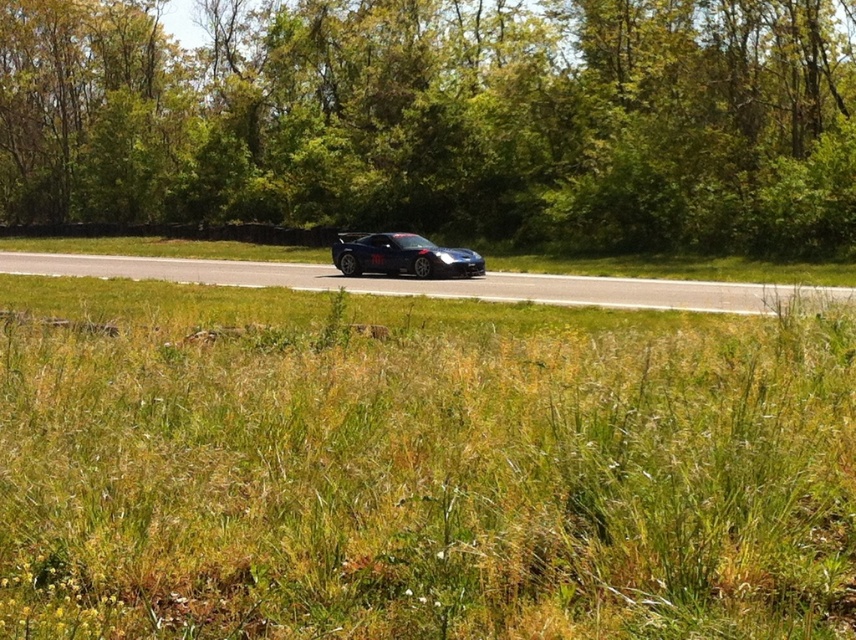
Question: Which of the following is the closest to the observer?

Choices:
 (A) (418, 248)
 (B) (502, 433)

Answer: (B)

Question: Is green grass at center thinner than shiny blue car at center?

Choices:
 (A) no
 (B) yes

Answer: (A)

Question: Does green grass at center appear over green leafy trees at center?

Choices:
 (A) yes
 (B) no

Answer: (B)

Question: Considering the real-world distances, which object is closest to the green grass at center?

Choices:
 (A) shiny blue car at center
 (B) glossy black car at center

Answer: (B)

Question: Is green leafy trees at center below shiny blue car at center?

Choices:
 (A) yes
 (B) no

Answer: (B)

Question: Which of these objects is positioned farthest from the green grass at center?

Choices:
 (A) shiny blue car at center
 (B) green leafy trees at center
 (C) glossy black car at center

Answer: (B)